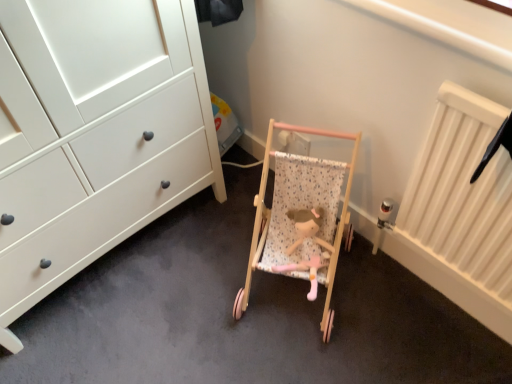
Question: Considering the relative sizes of wooden doll at center and wooden stroller at center in the image provided, is wooden doll at center thinner than wooden stroller at center?

Choices:
 (A) no
 (B) yes

Answer: (B)

Question: From a real-world perspective, is wooden doll at center located higher than wooden stroller at center?

Choices:
 (A) yes
 (B) no

Answer: (B)

Question: Is wooden doll at center not close to wooden stroller at center?

Choices:
 (A) no
 (B) yes

Answer: (A)

Question: Can you confirm if wooden doll at center is shorter than wooden stroller at center?

Choices:
 (A) yes
 (B) no

Answer: (A)

Question: Is wooden doll at center bigger than wooden stroller at center?

Choices:
 (A) no
 (B) yes

Answer: (A)

Question: From a real-world perspective, is wooden doll at center under wooden stroller at center?

Choices:
 (A) yes
 (B) no

Answer: (A)

Question: Is wooden doll at center at the back of wooden stroller at center?

Choices:
 (A) yes
 (B) no

Answer: (A)

Question: Is wooden stroller at center located outside wooden doll at center?

Choices:
 (A) yes
 (B) no

Answer: (A)

Question: Would you say wooden stroller at center contains wooden doll at center?

Choices:
 (A) yes
 (B) no

Answer: (A)

Question: Is wooden stroller at center to the left of wooden doll at center from the viewer's perspective?

Choices:
 (A) yes
 (B) no

Answer: (A)

Question: Is wooden stroller at center thinner than wooden doll at center?

Choices:
 (A) no
 (B) yes

Answer: (A)

Question: Considering the relative sizes of wooden stroller at center and wooden doll at center in the image provided, is wooden stroller at center bigger than wooden doll at center?

Choices:
 (A) no
 (B) yes

Answer: (B)

Question: From their relative heights in the image, would you say wooden stroller at center is taller or shorter than wooden doll at center?

Choices:
 (A) tall
 (B) short

Answer: (A)